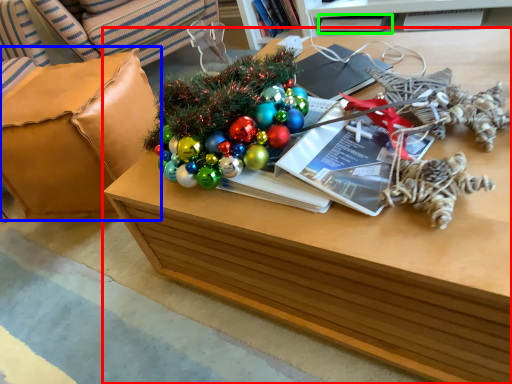
Question: Considering the real-world distances, which object is farthest from table (highlighted by a red box)? armchair (highlighted by a blue box) or book (highlighted by a green box)?

Choices:
 (A) armchair
 (B) book

Answer: (B)